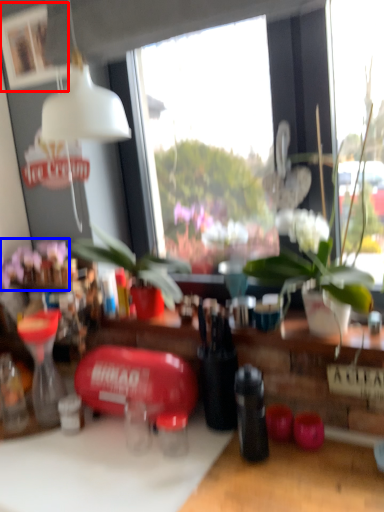
Question: Which of the following is the farthest to the observer, picture frame (highlighted by a red box) or flower (highlighted by a blue box)?

Choices:
 (A) picture frame
 (B) flower

Answer: (B)